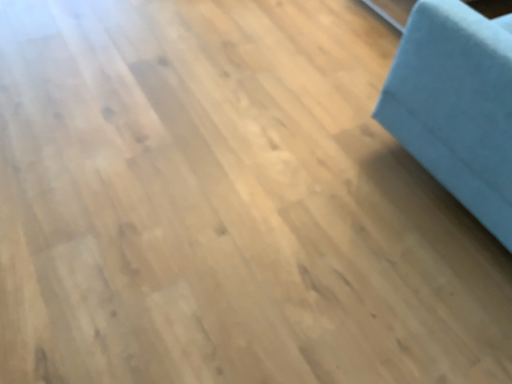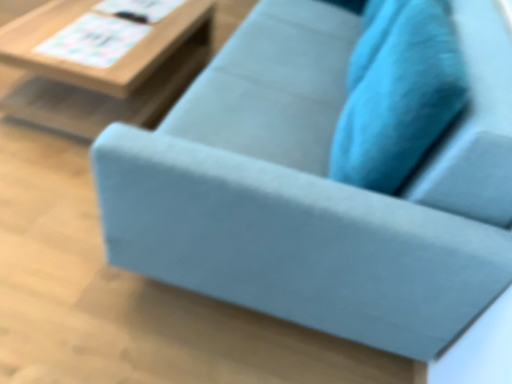
Question: How did the camera likely rotate when shooting the video?

Choices:
 (A) rotated downward
 (B) rotated upward

Answer: (B)